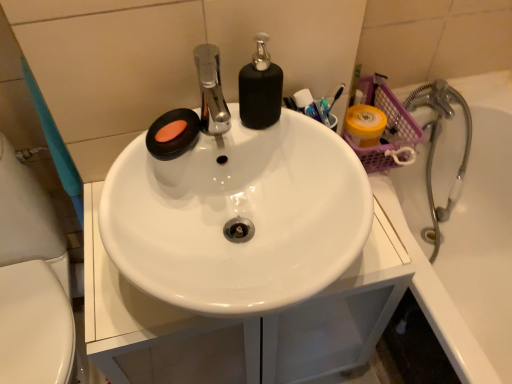
In order to click on metallic silver faucet at right in this screenshot , I will do `click(466, 238)`.

Can you tell me how much metallic silver faucet at right and black matte soap dispenser at center differ in facing direction?

They differ by 0.591 degrees in their facing directions.

Is metallic silver faucet at right not near black matte soap dispenser at center?

metallic silver faucet at right is near black matte soap dispenser at center, not far away.

Does metallic silver faucet at right have a greater width compared to black matte soap dispenser at center?

Correct, the width of metallic silver faucet at right exceeds that of black matte soap dispenser at center.

Between metallic silver faucet at right and black matte soap dispenser at center, which one has smaller size?

black matte soap dispenser at center.

Is white glossy sink at center not close to metallic silver faucet at right?

That's not correct — white glossy sink at center is a little close to metallic silver faucet at right.

Considering the sizes of objects white glossy sink at center and metallic silver faucet at right in the image provided, who is shorter, white glossy sink at center or metallic silver faucet at right?

white glossy sink at center.

From a real-world perspective, is white glossy sink at center positioned over metallic silver faucet at right based on gravity?

Yes, from a real-world perspective, white glossy sink at center is over metallic silver faucet at right

From the image's perspective, is white glossy sink at center located above or below metallic silver faucet at right?

From the image's perspective, white glossy sink at center appears below metallic silver faucet at right.

Do you think white glossy sink at left is within metallic silver faucet at right, or outside of it?

white glossy sink at left is not inside metallic silver faucet at right, it's outside.

Can you confirm if white glossy sink at left is taller than metallic silver faucet at right?

Indeed, white glossy sink at left has a greater height compared to metallic silver faucet at right.

Based on their sizes in the image, would you say white glossy sink at left is bigger or smaller than metallic silver faucet at right?

white glossy sink at left is bigger than metallic silver faucet at right.

In the image, is white glossy sink at left on the left side or the right side of metallic silver faucet at right?

white glossy sink at left is positioned on metallic silver faucet at right's left side.

Is the depth of white glossy sink at left less than that of white glossy sink at center?

No, white glossy sink at left is further to the viewer.

Consider the image. Is white glossy sink at left oriented towards white glossy sink at center?

No, white glossy sink at left is not oriented towards white glossy sink at center.

Is white glossy sink at left next to white glossy sink at center?

No, white glossy sink at left is not beside white glossy sink at center.

From a real-world perspective, is white glossy sink at left physically below white glossy sink at center?

Yes.

Considering the sizes of objects matte black soap at upper left and black matte soap dispenser at center in the image provided, who is taller, matte black soap at upper left or black matte soap dispenser at center?

black matte soap dispenser at center is taller.

From the picture: From the image's perspective, between matte black soap at upper left and black matte soap dispenser at center, which one is located above?

black matte soap dispenser at center.

Considering the sizes of objects matte black soap at upper left and black matte soap dispenser at center in the image provided, who is smaller, matte black soap at upper left or black matte soap dispenser at center?

Smaller between the two is matte black soap at upper left.

The width and height of the screenshot is (512, 384). What are the coordinates of `soap behind the black matte soap dispenser at center` in the screenshot? It's located at (174, 138).

Between black matte soap dispenser at center and matte black soap at upper left, which one has less height?

With less height is matte black soap at upper left.

From a real-world perspective, does black matte soap dispenser at center sit lower than matte black soap at upper left?

Incorrect, from a real-world perspective, black matte soap dispenser at center is higher than matte black soap at upper left.

Is black matte soap dispenser at center next to matte black soap at upper left?

black matte soap dispenser at center is not next to matte black soap at upper left, and they're not touching.

From the image's perspective, is metallic silver faucet at right below matte black soap at upper left?

Yes.

Considering the sizes of metallic silver faucet at right and matte black soap at upper left in the image, is metallic silver faucet at right bigger or smaller than matte black soap at upper left?

Considering their sizes, metallic silver faucet at right takes up more space than matte black soap at upper left.

From the picture: Considering the relative sizes of metallic silver faucet at right and matte black soap at upper left in the image provided, is metallic silver faucet at right shorter than matte black soap at upper left?

In fact, metallic silver faucet at right may be taller than matte black soap at upper left.

Which is closer to the camera, (x=474, y=273) or (x=163, y=150)?

The point (x=163, y=150) is in front.

You are a GUI agent. You are given a task and a screenshot of the screen. Output one action in this format:
    pyautogui.click(x=<x>, y=<y>)
    Task: Click on the bath below the black matte soap dispenser at center (from the image's perspective)
    
    Given the screenshot: What is the action you would take?
    pyautogui.click(x=466, y=238)

Find the location of a particular element. This screenshot has width=512, height=384. bath above the white glossy sink at center (from the image's perspective) is located at coordinates (466, 238).

Based on their spatial positions, is matte black soap at upper left or white glossy sink at left further from white glossy sink at center?

The object further to white glossy sink at center is white glossy sink at left.

Consider the image. Estimate the real-world distances between objects in this image. Which object is closer to matte black soap at upper left, white glossy sink at left or white glossy sink at center?

white glossy sink at center.

Looking at the image, which one is located further to white glossy sink at center, white glossy sink at left or black matte soap dispenser at center?

white glossy sink at left lies further to white glossy sink at center than the other object.

Based on their spatial positions, is metallic silver faucet at right or matte black soap at upper left further from white glossy sink at left?

metallic silver faucet at right is positioned further to the anchor white glossy sink at left.

From the image, which object appears to be nearer to white glossy sink at center, metallic silver faucet at right or black matte soap dispenser at center?

The object closer to white glossy sink at center is black matte soap dispenser at center.

When comparing their distances from white glossy sink at left, does metallic silver faucet at right or black matte soap dispenser at center seem further?

metallic silver faucet at right lies further to white glossy sink at left than the other object.

Estimate the real-world distances between objects in this image. Which object is further from matte black soap at upper left, black matte soap dispenser at center or white glossy sink at left?

The object further to matte black soap at upper left is white glossy sink at left.

When comparing their distances from metallic silver faucet at right, does matte black soap at upper left or white glossy sink at left seem closer?

matte black soap at upper left is closer to metallic silver faucet at right.

At what (x,y) coordinates should I click in order to perform the action: click on soap dispenser between white glossy sink at center and matte black soap at upper left along the z-axis. Please return your answer as a coordinate pair (x, y). Looking at the image, I should click on (260, 88).

Locate an element on the screen. This screenshot has width=512, height=384. soap between white glossy sink at left and black matte soap dispenser at center is located at coordinates (174, 138).

You are a GUI agent. You are given a task and a screenshot of the screen. Output one action in this format:
    pyautogui.click(x=<x>, y=<y>)
    Task: Click on the soap dispenser between white glossy sink at left and metallic silver faucet at right from left to right
    This screenshot has height=384, width=512.
    Given the screenshot: What is the action you would take?
    pyautogui.click(x=260, y=88)

This screenshot has width=512, height=384. I want to click on sink situated between white glossy sink at left and metallic silver faucet at right from left to right, so click(x=238, y=203).